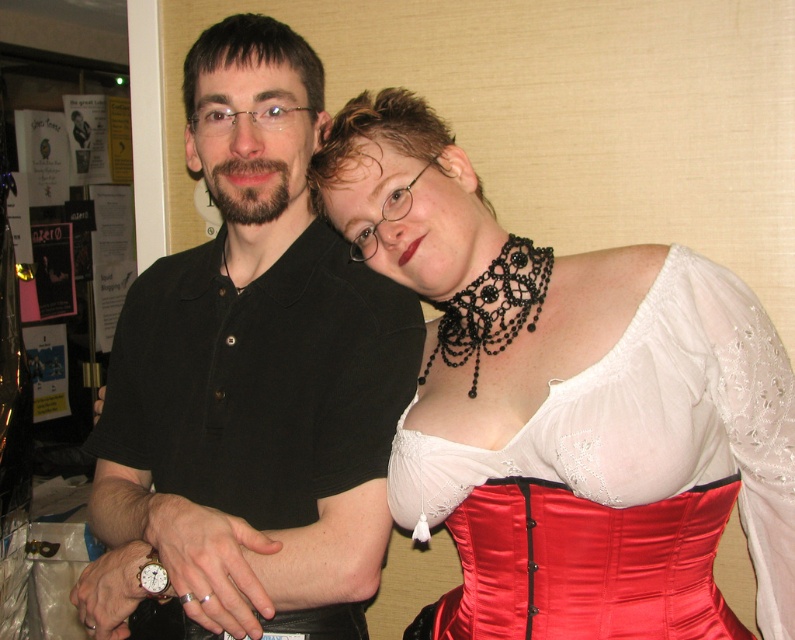
Based on the photo, how far apart are black matte shirt at center and satin red corset at center?

The distance of black matte shirt at center from satin red corset at center is 10.13 inches.

Between black matte shirt at center and satin red corset at center, which one appears on the left side from the viewer's perspective?

Positioned to the left is black matte shirt at center.

Locate an element on the screen. This screenshot has width=795, height=640. black matte shirt at center is located at coordinates (256, 369).

Identify the location of black matte shirt at center. (256, 369).